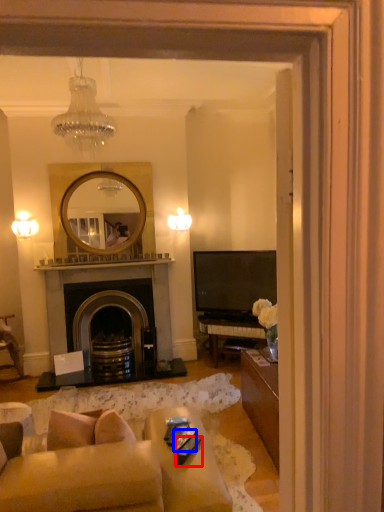
Question: Which of the following is the closest to the observer, remote control (highlighted by a red box) or remote control (highlighted by a blue box)?

Choices:
 (A) remote control
 (B) remote control

Answer: (A)